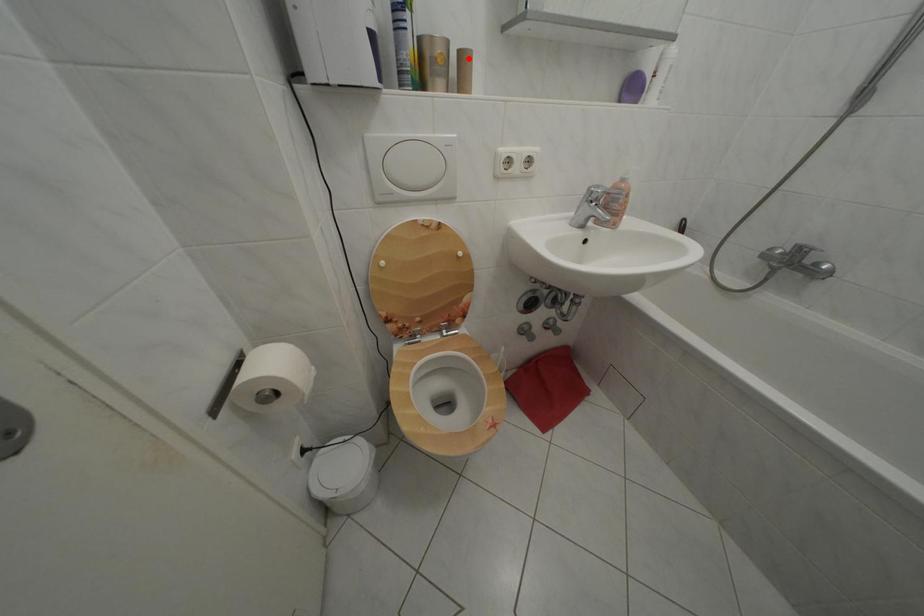
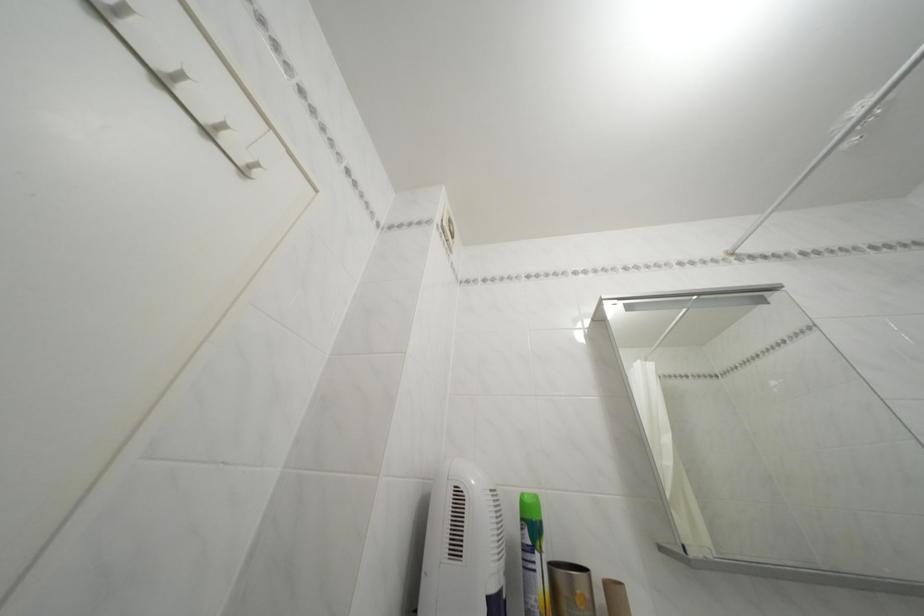
The point at the highlighted location is marked in the first image. Where is the corresponding point in the second image?

(614, 591)